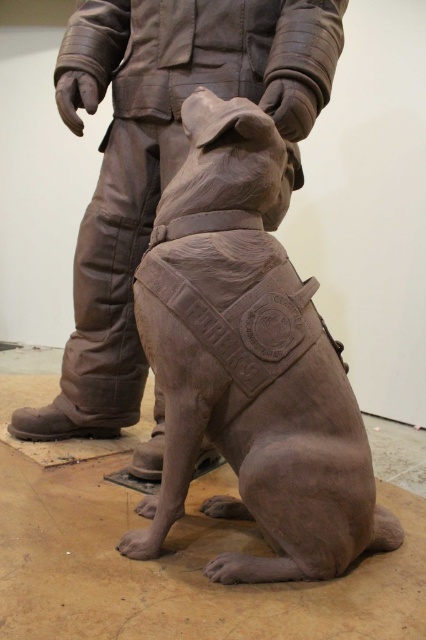
You are an art curator planning to display the matte clay dog at center and the matte bronze dog at center in a gallery. The gallery has a limited space of 24 inches between two display pedestals. Can both sculptures be placed on the pedestals without exceeding the space constraint?

The matte clay dog at center is 22.75 inches from the matte bronze dog at center, so they can be placed on the pedestals as the distance between them is within the 24 inches space constraint.

You are an art curator planning to display both the matte clay dog at center and the matte bronze dog at center in a gallery. Given their widths, which one would require a wider base to prevent tipping over?

The matte bronze dog at center requires a wider base because its width is greater than the matte clay dog at center, making it potentially less stable without proper support.

You are an art curator examining two sculptures in a gallery. You notice a matte clay dog at center and a matte bronze dog at center. According to the spatial arrangement, which dog is located to the right of the other?

The matte clay dog at center is positioned on the right side of the matte bronze dog at center, meaning the clay dog is to the right of the bronze dog.